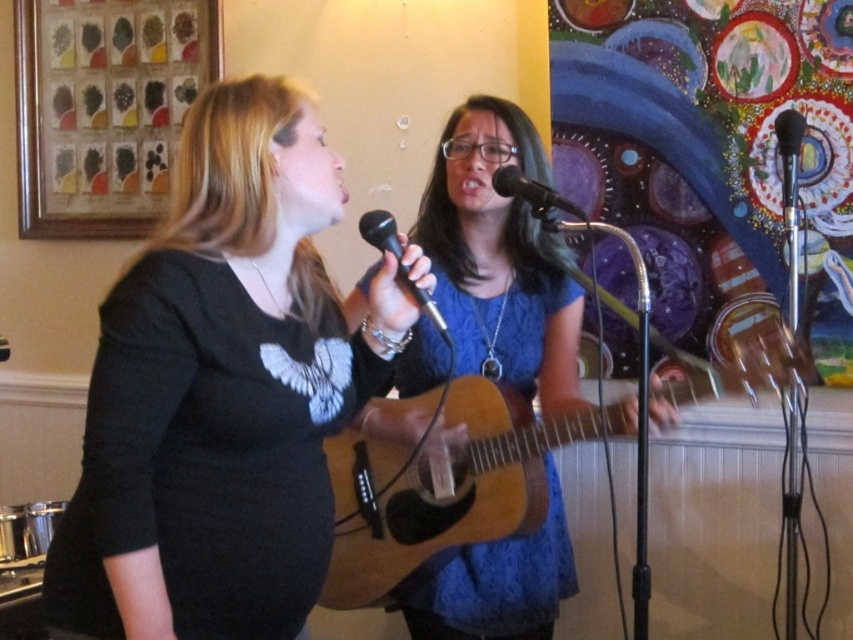
Can you confirm if black matte shirt at center is positioned to the left of black plastic microphone at center?

Yes, black matte shirt at center is to the left of black plastic microphone at center.

How far apart are black matte shirt at center and black plastic microphone at center?

black matte shirt at center is 12.73 inches from black plastic microphone at center.

Is point (112, 588) closer to viewer compared to point (428, 314)?

Yes.

This screenshot has width=853, height=640. In order to click on black matte shirt at center in this screenshot , I will do `click(221, 392)`.

Is blue fabric guitar at center to the left of light brown acoustic guitar at center from the viewer's perspective?

Correct, you'll find blue fabric guitar at center to the left of light brown acoustic guitar at center.

Between point (492, 100) and point (389, 545), which one is positioned in front?

Point (389, 545) is more forward.

Find the location of a particular element. The height and width of the screenshot is (640, 853). blue fabric guitar at center is located at coordinates (500, 259).

Is light brown acoustic guitar at center to the right of black plastic microphone at center from the viewer's perspective?

Yes, light brown acoustic guitar at center is to the right of black plastic microphone at center.

Can you confirm if light brown acoustic guitar at center is taller than black plastic microphone at center?

Indeed, light brown acoustic guitar at center has a greater height compared to black plastic microphone at center.

Is point (445, 460) in front of point (376, 212)?

No.

Image resolution: width=853 pixels, height=640 pixels. What are the coordinates of `light brown acoustic guitar at center` in the screenshot? It's located at (440, 480).